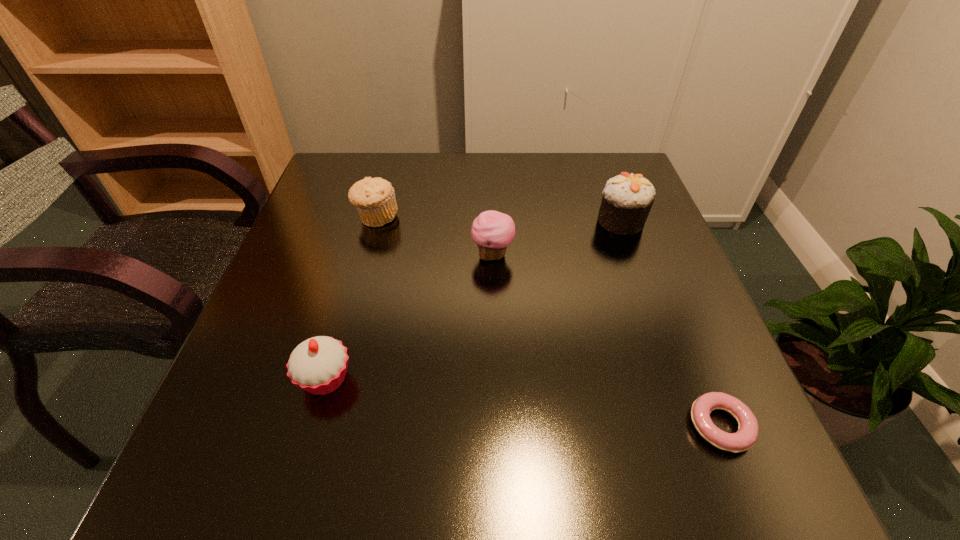
At what (x,y) coordinates should I click in order to perform the action: click on vacant space located on the back of the doughnut. Please return your answer as a coordinate pair (x, y). Image resolution: width=960 pixels, height=540 pixels. Looking at the image, I should click on [659, 273].

You are a GUI agent. You are given a task and a screenshot of the screen. Output one action in this format:
    pyautogui.click(x=<x>, y=<y>)
    Task: Click on the object located at the near edge
    This screenshot has height=540, width=960.
    Given the screenshot: What is the action you would take?
    pyautogui.click(x=746, y=436)

This screenshot has height=540, width=960. What are the coordinates of `muffin that is at the left edge` in the screenshot? It's located at (374, 198).

Locate an element on the screen. cupcake that is at the left edge is located at coordinates (318, 365).

This screenshot has height=540, width=960. I want to click on cupcake at the right edge, so click(627, 199).

Find the location of `doughnut present at the right edge`. doughnut present at the right edge is located at coordinates (746, 436).

This screenshot has height=540, width=960. What are the coordinates of `object located at the near right corner` in the screenshot? It's located at (746, 436).

In the image, there is a desktop. At what (x,y) coordinates should I click in order to perform the action: click on free region at the far edge. Please return your answer as a coordinate pair (x, y). This screenshot has height=540, width=960. Looking at the image, I should click on (409, 161).

Where is `vacant position at the left edge of the desktop`? This screenshot has height=540, width=960. vacant position at the left edge of the desktop is located at coordinates (330, 230).

Locate an element on the screen. Image resolution: width=960 pixels, height=540 pixels. vacant space at the right edge is located at coordinates (615, 248).